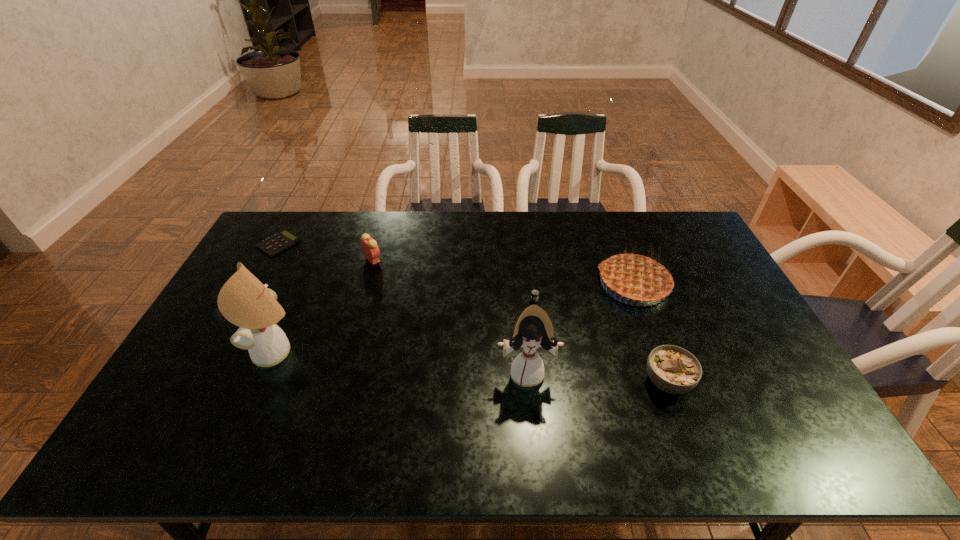
The dolls are evenly distributed in the image. To maintain this, where would you place another doll on the right? Please point to a free space. Please provide its 2D coordinates. Your answer should be formatted as a tuple, i.e. [(x, y)], where the tuple contains the x and y coordinates of a point satisfying the conditions above.

[(799, 394)]